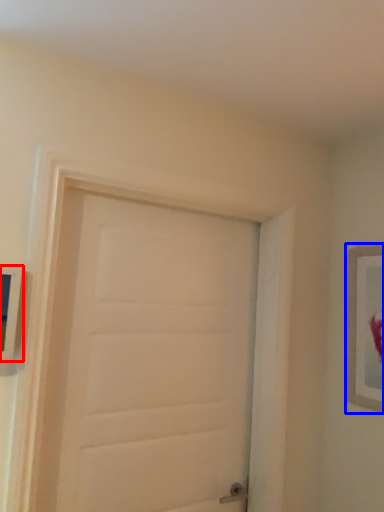
Question: Which object is closer to the camera taking this photo, picture frame (highlighted by a red box) or picture frame (highlighted by a blue box)?

Choices:
 (A) picture frame
 (B) picture frame

Answer: (A)